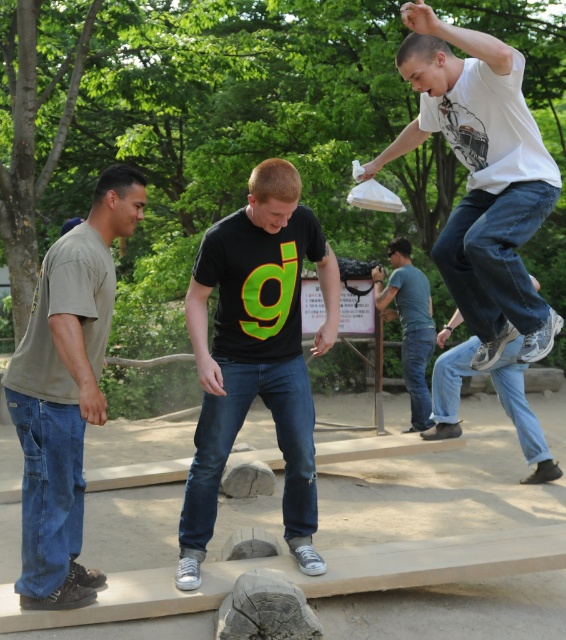
Question: Can you confirm if matte khaki t-shirt at left is wider than blue jeans at center?

Choices:
 (A) no
 (B) yes

Answer: (B)

Question: Which object is the closest to the denim jeans at center?

Choices:
 (A) matte khaki t-shirt at left
 (B) blue jeans at center
 (C) white matte shirt at upper right

Answer: (B)

Question: Where is matte khaki t-shirt at left located in relation to blue jeans at center in the image?

Choices:
 (A) below
 (B) above

Answer: (A)

Question: Among these objects, which one is nearest to the camera?

Choices:
 (A) black matte t-shirt at center
 (B) white matte shirt at upper right
 (C) blue jeans at center
 (D) denim jeans at center

Answer: (B)

Question: Does black matte t-shirt at center have a greater width compared to denim jeans at center?

Choices:
 (A) no
 (B) yes

Answer: (A)

Question: Which of the following is the closest to the observer?

Choices:
 (A) (224, 460)
 (B) (422, 330)
 (C) (57, 413)

Answer: (C)